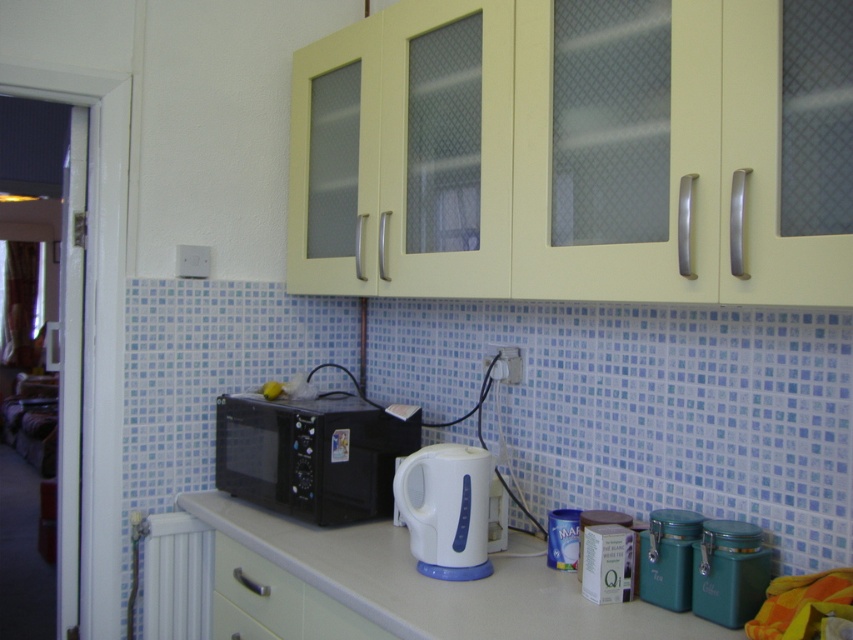
Question: Which is farther from the green matte drawer at lower center?

Choices:
 (A) teal matte canister at lower right
 (B) white plastic radiator at lower left
 (C) white plastic kettle at center
 (D) white glossy counter at center

Answer: (A)

Question: Which object is farther from the camera taking this photo?

Choices:
 (A) teal matte canister at lower right
 (B) white glossy counter at center

Answer: (A)

Question: Where is white plastic kettle at center located in relation to green matte drawer at lower center in the image?

Choices:
 (A) above
 (B) below

Answer: (A)

Question: Estimate the real-world distances between objects in this image. Which object is farther from the white plastic radiator at lower left?

Choices:
 (A) green matte drawer at lower center
 (B) black matte microwave at lower center

Answer: (B)

Question: Can you confirm if white glossy counter at center is smaller than green matte drawer at lower center?

Choices:
 (A) yes
 (B) no

Answer: (B)

Question: Can you confirm if white glossy counter at center is bigger than teal matte canister at lower right?

Choices:
 (A) yes
 (B) no

Answer: (A)